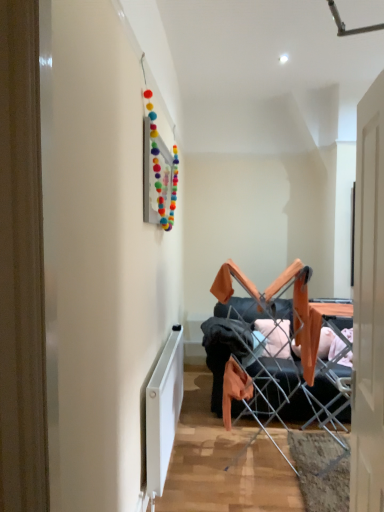
Question: In terms of height, does white matte radiator at lower left look taller or shorter compared to orange fabric chair at center?

Choices:
 (A) short
 (B) tall

Answer: (A)

Question: Looking at their shapes, would you say white matte radiator at lower left is wider or thinner than orange fabric chair at center?

Choices:
 (A) thin
 (B) wide

Answer: (A)

Question: From a real-world perspective, is white matte radiator at lower left positioned above or below orange fabric chair at center?

Choices:
 (A) below
 (B) above

Answer: (A)

Question: In terms of size, does orange fabric chair at center appear bigger or smaller than white matte radiator at lower left?

Choices:
 (A) small
 (B) big

Answer: (B)

Question: Is orange fabric chair at center wider or thinner than white matte radiator at lower left?

Choices:
 (A) thin
 (B) wide

Answer: (B)

Question: Would you say orange fabric chair at center is inside or outside white matte radiator at lower left?

Choices:
 (A) outside
 (B) inside

Answer: (A)

Question: From the image's perspective, is orange fabric chair at center located above or below white matte radiator at lower left?

Choices:
 (A) above
 (B) below

Answer: (A)